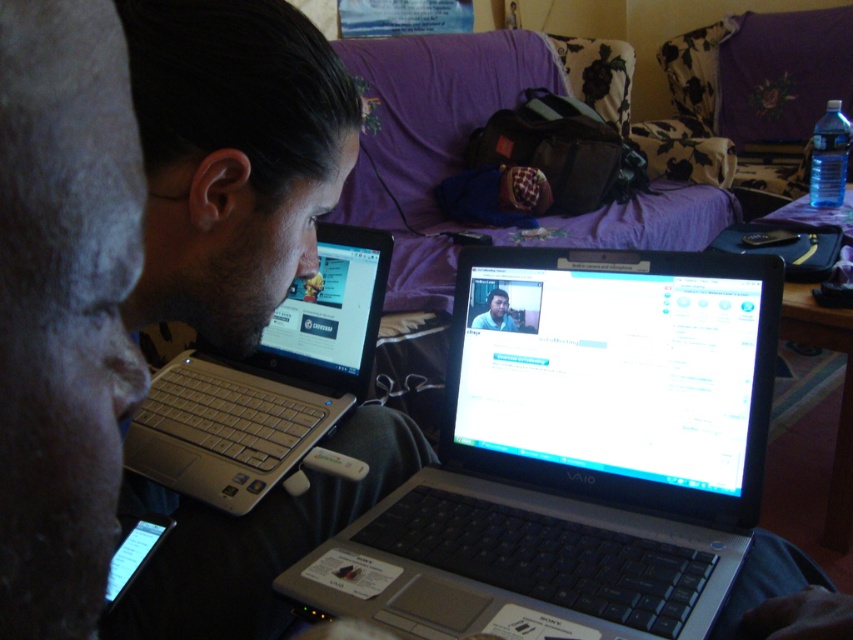
You are organizing a tech event and need to place two identical matte black laptops on a shelf. The shelf has limited vertical space. You have the matte black laptop at left and the matte black laptop at center. Which one requires more vertical space?

The matte black laptop at left requires more vertical space because it is much taller than the matte black laptop at center.

What is the color and material of the object located at the coordinates point (577, 454)?

The object at point (577, 454) is a black plastic laptop at center.